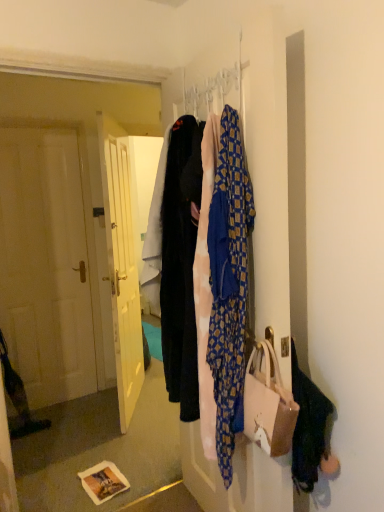
What do you see at coordinates (211, 91) in the screenshot? I see `metallic silver hanger at upper center` at bounding box center [211, 91].

In order to face velvet black pants at center, should I rotate leftwards or rightwards?

Rotate left and turn 0.068 degrees.

The width and height of the screenshot is (384, 512). Identify the location of velvet black pants at center. (181, 265).

Image resolution: width=384 pixels, height=512 pixels. What are the coordinates of `blue patterned fabric at center` in the screenshot? It's located at (181, 262).

Which of these two, blue patterned fabric at center or velvet black pants at center, stands shorter?

velvet black pants at center.

Where is `garment above the blue patterned fabric at center (from a real-world perspective)`? The height and width of the screenshot is (512, 384). garment above the blue patterned fabric at center (from a real-world perspective) is located at coordinates (181, 265).

From the picture: Which point is more distant from viewer, (221, 352) or (172, 369)?

The point (172, 369) is more distant.

Considering the positions of points (170, 230) and (190, 91), is point (170, 230) closer to camera compared to point (190, 91)?

Yes, it is in front of point (190, 91).

Can you see velvet black pants at center touching metallic silver hanger at upper center?

No.

Considering their positions, is velvet black pants at center located in front of or behind metallic silver hanger at upper center?

In the image, velvet black pants at center appears behind metallic silver hanger at upper center.

From the image's perspective, is velvet black pants at center under blue patterned fabric at center?

Actually, velvet black pants at center appears above blue patterned fabric at center in the image.

Between velvet black pants at center and blue patterned fabric at center, which one has larger width?

With larger width is velvet black pants at center.

Is velvet black pants at center smaller than blue patterned fabric at center?

Indeed, velvet black pants at center has a smaller size compared to blue patterned fabric at center.

From the picture: Would you say blue patterned fabric at center is part of metallic silver hanger at upper center's contents?

No.

How many degrees apart are the facing directions of metallic silver hanger at upper center and blue patterned fabric at center?

1.65 degrees separate the facing orientations of metallic silver hanger at upper center and blue patterned fabric at center.

From the picture: Measure the distance from metallic silver hanger at upper center to blue patterned fabric at center.

metallic silver hanger at upper center is 18.18 inches from blue patterned fabric at center.

In the image, is metallic silver hanger at upper center on the left side or the right side of blue patterned fabric at center?

Based on their positions, metallic silver hanger at upper center is located to the left of blue patterned fabric at center.

From the image's perspective, which is below, metallic silver hanger at upper center or velvet black pants at center?

velvet black pants at center is shown below in the image.

Consider the image. Between metallic silver hanger at upper center and velvet black pants at center, which one is positioned behind?

velvet black pants at center is more distant.

Which object is positioned more to the right, metallic silver hanger at upper center or velvet black pants at center?

metallic silver hanger at upper center.

Is point (197, 89) less distant than point (188, 205)?

No, (197, 89) is further to viewer.

How many degrees apart are the facing directions of blue patterned fabric at center and metallic silver hanger at upper center?

There is a 1.65-degree angle between the facing directions of blue patterned fabric at center and metallic silver hanger at upper center.

Consider the image. Considering the relative positions of blue patterned fabric at center and metallic silver hanger at upper center in the image provided, is blue patterned fabric at center to the left of metallic silver hanger at upper center from the viewer's perspective?

In fact, blue patterned fabric at center is to the right of metallic silver hanger at upper center.

Looking at this image, between blue patterned fabric at center and metallic silver hanger at upper center, which one has more height?

blue patterned fabric at center.

The image size is (384, 512). I want to click on closet that is on the right side of velvet black pants at center, so click(181, 262).

Where is `garment behind the metallic silver hanger at upper center`? garment behind the metallic silver hanger at upper center is located at coordinates (181, 265).

Looking at the image, which one is located closer to blue patterned fabric at center, metallic silver hanger at upper center or velvet black pants at center?

velvet black pants at center.

When comparing their distances from blue patterned fabric at center, does velvet black pants at center or metallic silver hanger at upper center seem closer?

velvet black pants at center.

From the image, which object appears to be farther from velvet black pants at center, blue patterned fabric at center or metallic silver hanger at upper center?

metallic silver hanger at upper center is positioned further to the anchor velvet black pants at center.

From the image, which object appears to be nearer to metallic silver hanger at upper center, blue patterned fabric at center or velvet black pants at center?

Among the two, velvet black pants at center is located nearer to metallic silver hanger at upper center.

Considering their positions, is metallic silver hanger at upper center positioned closer to velvet black pants at center than blue patterned fabric at center?

Based on the image, blue patterned fabric at center appears to be nearer to velvet black pants at center.

Looking at the image, which one is located further to metallic silver hanger at upper center, velvet black pants at center or blue patterned fabric at center?

Based on the image, blue patterned fabric at center appears to be further to metallic silver hanger at upper center.

The image size is (384, 512). In order to click on garment between metallic silver hanger at upper center and blue patterned fabric at center in the up-down direction in this screenshot , I will do `click(181, 265)`.